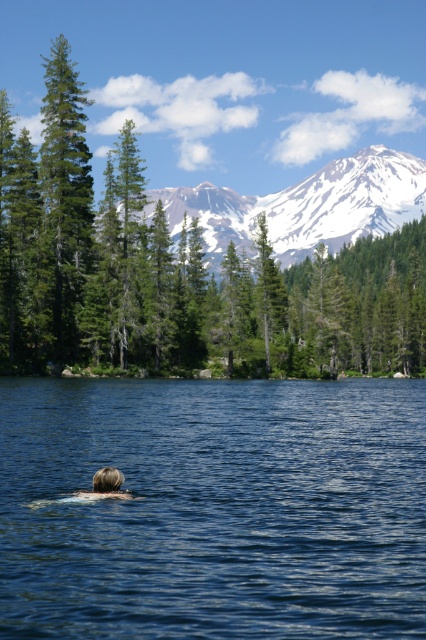
Question: Can you confirm if green matte tree at upper center is positioned below blonde hair at lower center?

Choices:
 (A) no
 (B) yes

Answer: (A)

Question: Which point is farther to the camera?

Choices:
 (A) green matte tree at upper center
 (B) blue liquid water at center
 (C) snowy mountain at upper center
 (D) blonde hair at lower center

Answer: (C)

Question: Where is green matte tree at upper center located in relation to green matte tree at upper left in the image?

Choices:
 (A) below
 (B) above

Answer: (B)

Question: Based on their relative distances, which object is nearer to the snowy mountain at upper center?

Choices:
 (A) green matte tree at upper left
 (B) blue liquid water at center
 (C) blonde hair at lower center
 (D) green matte tree at upper center

Answer: (D)

Question: Is blue liquid water at center to the right of green matte tree at upper left from the viewer's perspective?

Choices:
 (A) yes
 (B) no

Answer: (A)

Question: Which of the following is the farthest from the observer?

Choices:
 (A) snowy mountain at upper center
 (B) blonde hair at lower center
 (C) blue liquid water at center
 (D) green matte tree at upper center

Answer: (A)